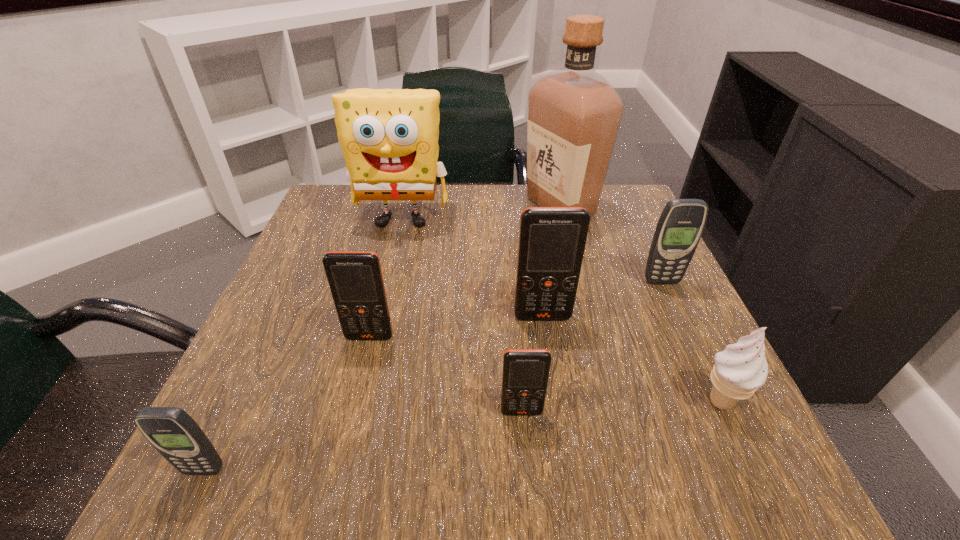
Identify the location of free spot between the fourth farthest object and the icecream. (632, 359).

The image size is (960, 540). What are the coordinates of `vacant area that lies between the sponge and the fourth farthest cellular telephone` in the screenshot? It's located at (462, 315).

You are a GUI agent. You are given a task and a screenshot of the screen. Output one action in this format:
    pyautogui.click(x=<x>, y=<y>)
    Task: Click on the vacant space that is in between the nearest orange cellular telephone and the leftmost orange cellular telephone
    
    Given the screenshot: What is the action you would take?
    [x=445, y=374]

This screenshot has width=960, height=540. I want to click on vacant space in between the nearer gray cellular telephone and the icecream, so click(463, 436).

The height and width of the screenshot is (540, 960). What are the coordinates of `free space between the second tallest object and the tallest object` in the screenshot? It's located at (482, 213).

This screenshot has width=960, height=540. I want to click on free point between the yellow sponge and the smallest orange cellular telephone, so click(x=462, y=315).

Identify the location of vacant area that lies between the second cellular telephone from left to right and the liquor. (465, 272).

At what (x,y) coordinates should I click in order to perform the action: click on the fifth closest object to the tallest cellular telephone. Please return your answer as a coordinate pair (x, y). Looking at the image, I should click on (574, 113).

Find the location of a particular element. The image size is (960, 540). object that is the sixth closest one to the second nearest cellular telephone is located at coordinates (389, 137).

Identify which cellular telephone is the third closest to the sixth shortest object. Please provide its 2D coordinates. Your answer should be formatted as a tuple, i.e. [(x, y)], where the tuple contains the x and y coordinates of a point satisfying the conditions above.

[(355, 278)]